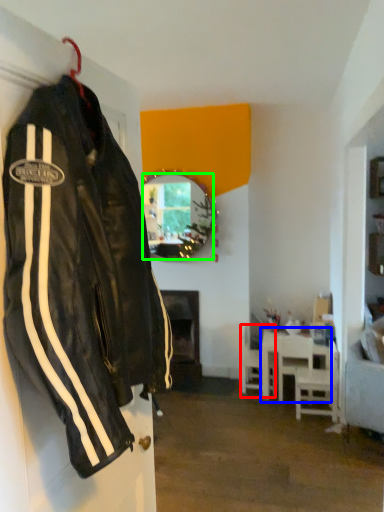
Question: Which object is the closest to the chair (highlighted by a red box)? Choose among these: table (highlighted by a blue box) or mirror (highlighted by a green box).

Choices:
 (A) table
 (B) mirror

Answer: (A)